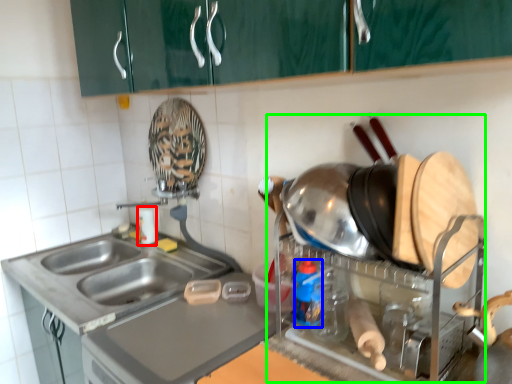
Question: Based on their relative distances, which object is farther from bottle (highlighted by a red box)? Choose from bottle (highlighted by a blue box) and appliance (highlighted by a green box).

Choices:
 (A) bottle
 (B) appliance

Answer: (B)